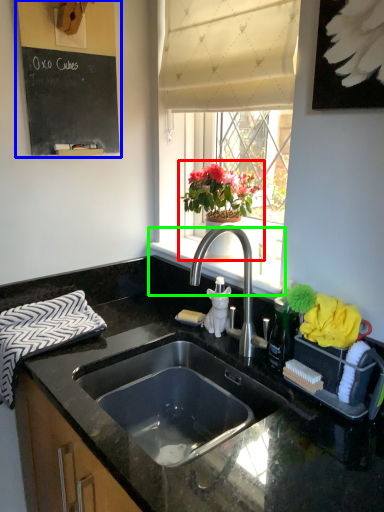
Question: Which object is the closest to the houseplant (highlighted by a red box)? Choose among these: bulletin board (highlighted by a blue box) or window sill (highlighted by a green box).

Choices:
 (A) bulletin board
 (B) window sill

Answer: (B)